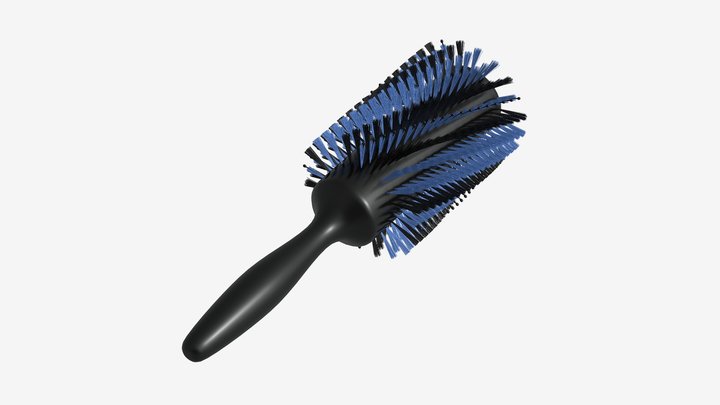
You are a GUI agent. You are given a task and a screenshot of the screen. Output one action in this format:
    pyautogui.click(x=<x>, y=<y>)
    Task: Click on the hair brush
    The width and height of the screenshot is (720, 405).
    Given the screenshot: What is the action you would take?
    pyautogui.click(x=400, y=183), pyautogui.click(x=279, y=268)